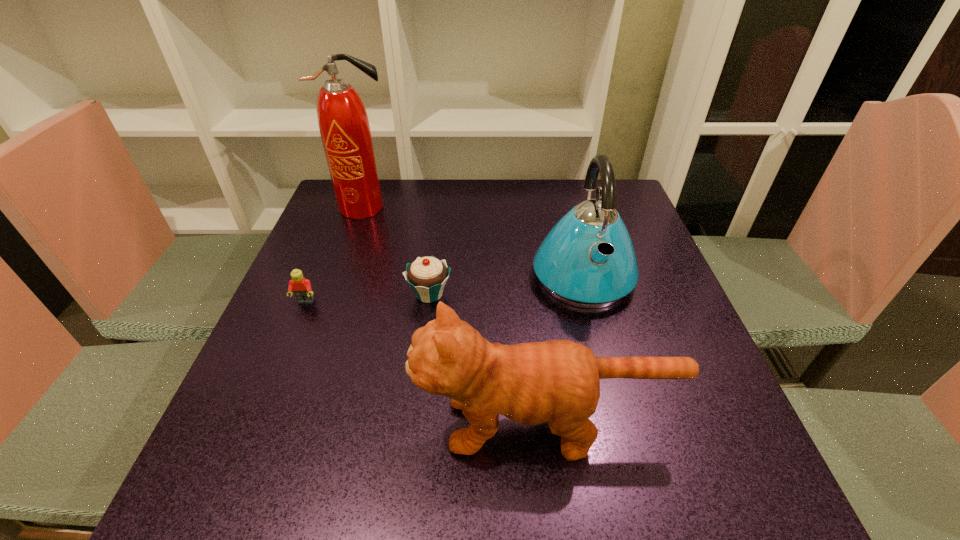
The image size is (960, 540). In order to click on vacant space located on the face of the cat in this screenshot , I will do `click(334, 424)`.

What are the coordinates of `free location located on the right of the cupcake` in the screenshot? It's located at click(x=502, y=294).

This screenshot has width=960, height=540. What are the coordinates of `free spot located 0.380m on the face of the Lego` in the screenshot? It's located at 228,489.

At what (x,y) coordinates should I click in order to perform the action: click on object that is at the far edge. Please return your answer as a coordinate pair (x, y). Looking at the image, I should click on (343, 122).

Locate an element on the screen. The width and height of the screenshot is (960, 540). object at the near edge is located at coordinates (557, 381).

This screenshot has height=540, width=960. Find the location of `fire extinguisher that is positioned at the left edge`. fire extinguisher that is positioned at the left edge is located at coordinates (343, 122).

Identify the location of Lego located in the left edge section of the desktop. (302, 289).

Where is `kettle located in the right edge section of the desktop`? The image size is (960, 540). kettle located in the right edge section of the desktop is located at coordinates (588, 260).

Locate an element on the screen. This screenshot has height=540, width=960. cat that is at the right edge is located at coordinates (557, 381).

At what (x,y) coordinates should I click in order to perform the action: click on object at the far left corner. Please return your answer as a coordinate pair (x, y). Looking at the image, I should click on (343, 122).